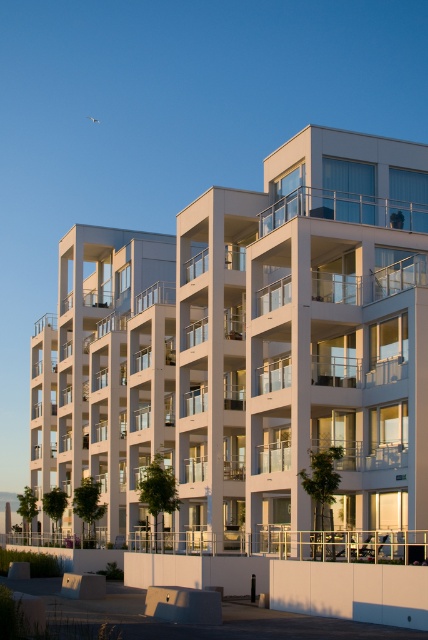
Question: Which object appears farthest from the camera in this image?

Choices:
 (A) white smooth building at center
 (B) clear glass balcony at upper center

Answer: (B)

Question: Is white smooth building at center positioned behind clear glass balcony at upper center?

Choices:
 (A) no
 (B) yes

Answer: (A)

Question: Which of the following is the closest to the observer?

Choices:
 (A) (394, 221)
 (B) (347, 280)

Answer: (B)

Question: Does white smooth building at center have a lesser width compared to clear glass balcony at upper center?

Choices:
 (A) no
 (B) yes

Answer: (A)

Question: Does white smooth building at center appear on the right side of clear glass balcony at upper center?

Choices:
 (A) yes
 (B) no

Answer: (B)